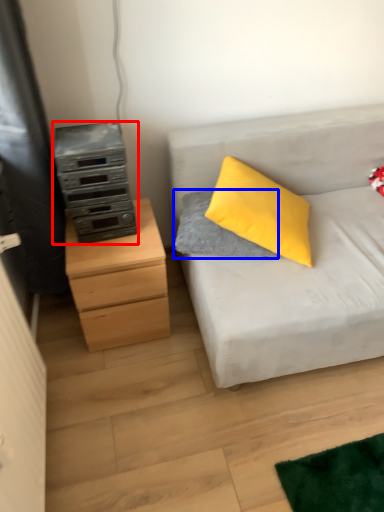
Question: Which point is closer to the camera, appliance (highlighted by a red box) or gray (highlighted by a blue box)?

Choices:
 (A) appliance
 (B) gray

Answer: (A)